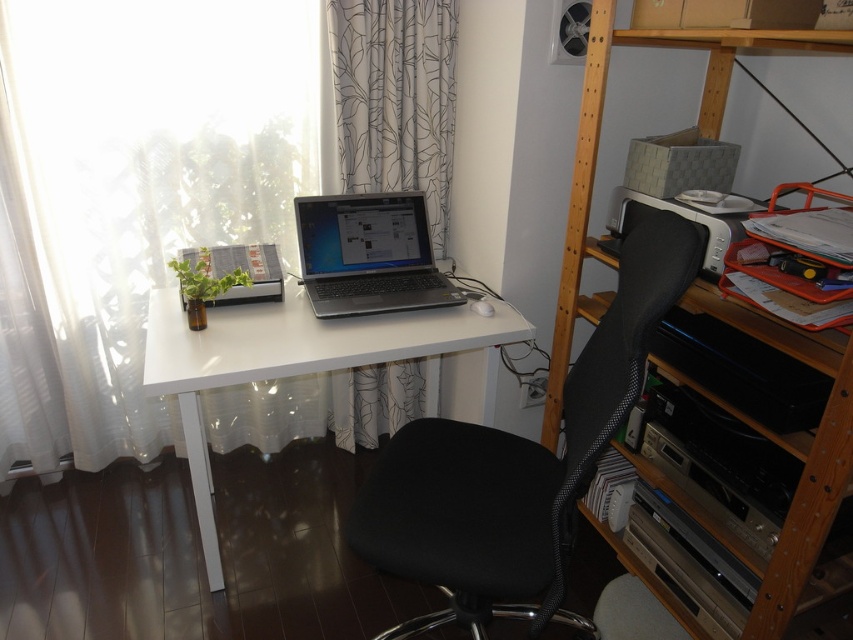
Question: Does black fabric swivel chair at center appear on the left side of wooden bookshelf at upper right?

Choices:
 (A) yes
 (B) no

Answer: (A)

Question: Among these points, which one is nearest to the camera?

Choices:
 (A) (49, 250)
 (B) (595, 467)

Answer: (B)

Question: Which object is closer to the camera taking this photo?

Choices:
 (A) black fabric swivel chair at center
 (B) wooden bookshelf at upper right
 (C) satin black laptop at center

Answer: (A)

Question: Which object appears closest to the camera in this image?

Choices:
 (A) black fabric swivel chair at center
 (B) wooden bookshelf at upper right

Answer: (A)

Question: Can you confirm if black fabric swivel chair at center is positioned to the left of white printed curtain at upper center?

Choices:
 (A) yes
 (B) no

Answer: (B)

Question: Considering the relative positions of white sheer curtain at left and wooden bookshelf at upper right in the image provided, where is white sheer curtain at left located with respect to wooden bookshelf at upper right?

Choices:
 (A) above
 (B) below

Answer: (B)